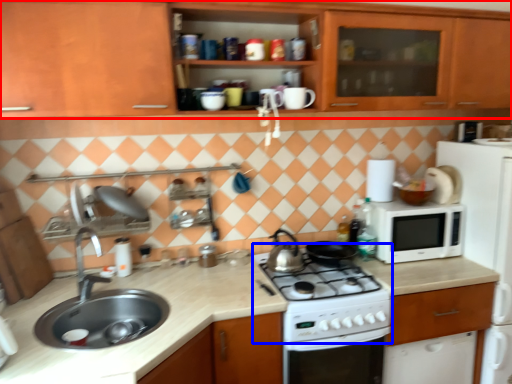
Question: Which point is closer to the camera, cabinetry (highlighted by a red box) or gas stove (highlighted by a blue box)?

Choices:
 (A) cabinetry
 (B) gas stove

Answer: (A)